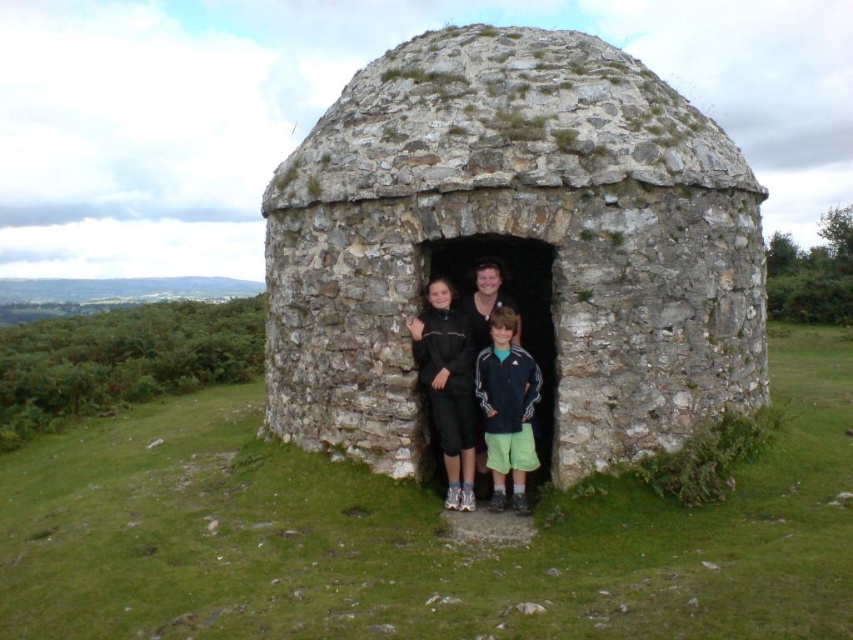
Question: Does dark blue adidas jacket at center appear over matte black jacket at center?

Choices:
 (A) no
 (B) yes

Answer: (A)

Question: Among these points, which one is nearest to the camera?

Choices:
 (A) (495, 429)
 (B) (718, 291)
 (C) (502, 284)

Answer: (A)

Question: Which point appears farthest from the camera in this image?

Choices:
 (A) (409, 211)
 (B) (491, 403)

Answer: (B)

Question: Is rough stone dome at center further to the viewer compared to matte black jacket at center?

Choices:
 (A) no
 (B) yes

Answer: (A)

Question: From the image, what is the correct spatial relationship of rough stone dome at center in relation to dark blue adidas jacket at center?

Choices:
 (A) left
 (B) right

Answer: (B)

Question: Which is farther from the dark blue adidas jacket at center?

Choices:
 (A) rough stone dome at center
 (B) matte black jacket at center

Answer: (A)